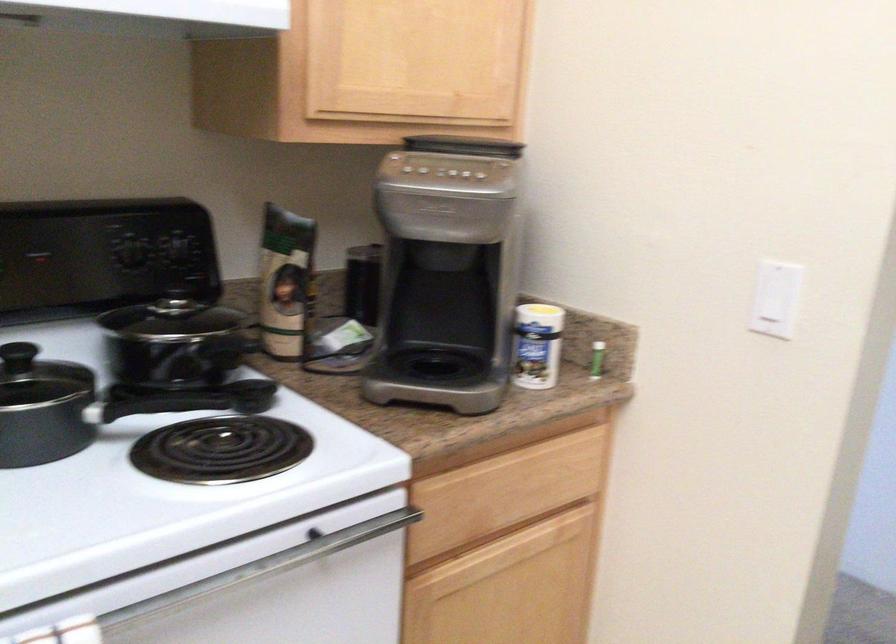
Where would you press the coffee maker buttons? Please return your answer as a coordinate pair (x, y).

(483, 178)